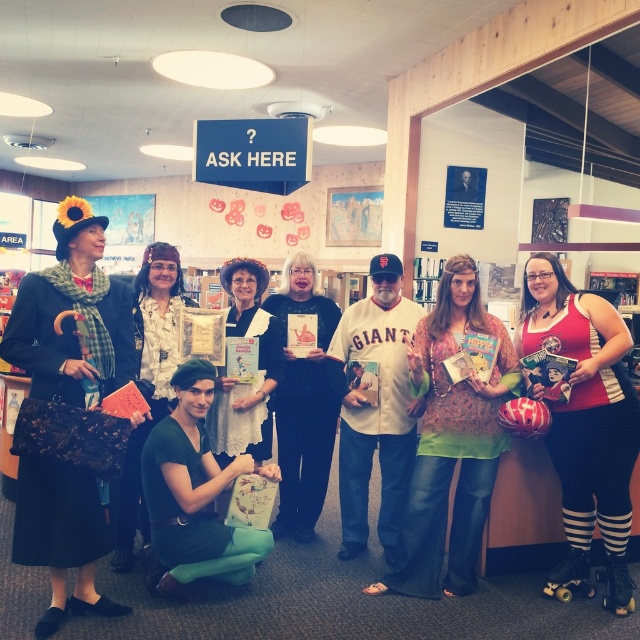
You are organizing a costume party and need to ensure all participants have matching attire. You notice two central figures wearing the red and white striped leggings at center and the white jersey at center. Which of these two items is smaller in size?

A: The red and white striped leggings at center has a smaller size compared to the white jersey at center.